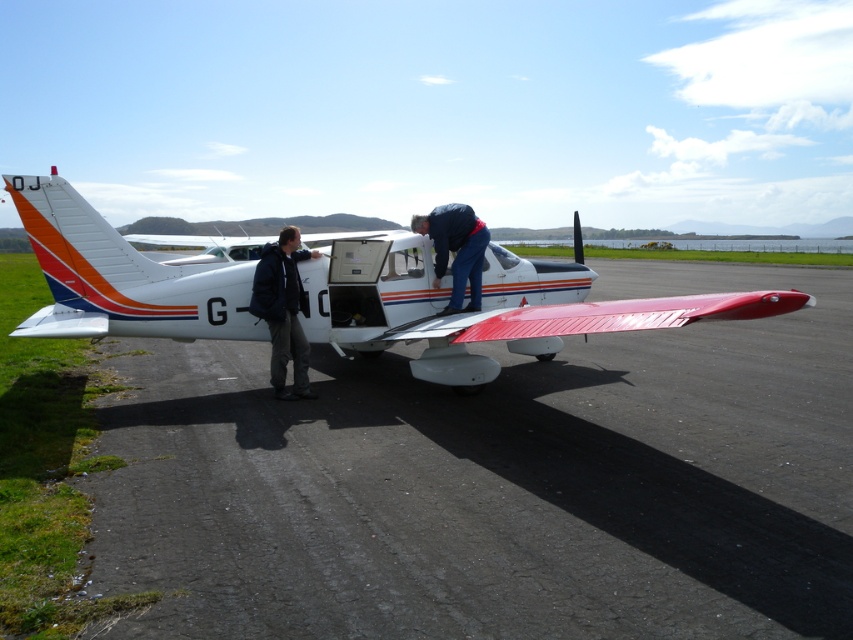
Which is above, smooth asphalt runway at lower center or white glossy airplane at center?

white glossy airplane at center is above.

Between point (509, 444) and point (18, 212), which one is positioned in front?

Point (509, 444) is more forward.

Find the location of `smooth asphalt runway at lower center`. smooth asphalt runway at lower center is located at coordinates tap(496, 483).

Is smooth asphalt runway at lower center taller than blue jeans at center?

No.

Is smooth asphalt runway at lower center above blue jeans at center?

Actually, smooth asphalt runway at lower center is below blue jeans at center.

This screenshot has width=853, height=640. What do you see at coordinates (496, 483) in the screenshot? I see `smooth asphalt runway at lower center` at bounding box center [496, 483].

Where is `smooth asphalt runway at lower center`? smooth asphalt runway at lower center is located at coordinates (496, 483).

Is white glossy airplane at center to the left of blue jeans at center from the viewer's perspective?

Yes, white glossy airplane at center is to the left of blue jeans at center.

Can you confirm if white glossy airplane at center is positioned below blue jeans at center?

Yes.

Is point (350, 273) closer to camera compared to point (422, 216)?

That is True.

Locate an element on the screen. Image resolution: width=853 pixels, height=640 pixels. white glossy airplane at center is located at coordinates (488, 308).